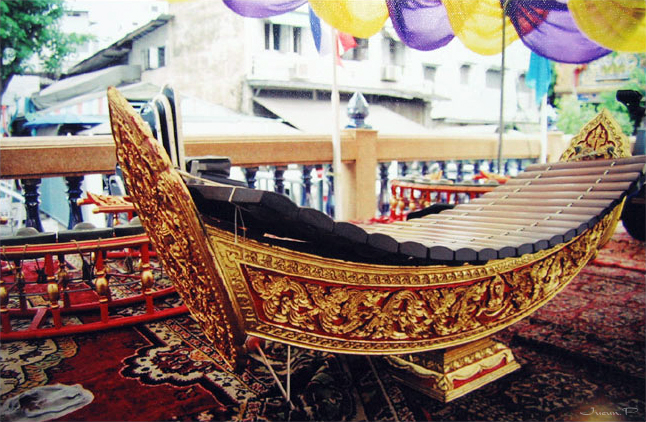
The height and width of the screenshot is (422, 646). What are the coordinates of `finial` in the screenshot? It's located at (357, 109).